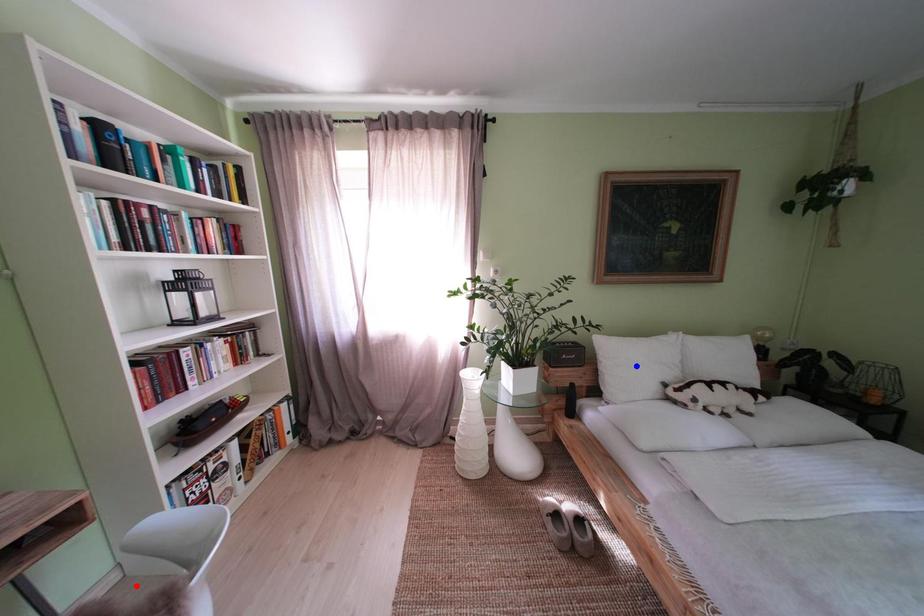
Question: In the image, two points are highlighted. Which point is nearer to the camera? Reply with the corresponding letter.

Choices:
 (A) blue point
 (B) red point

Answer: (B)